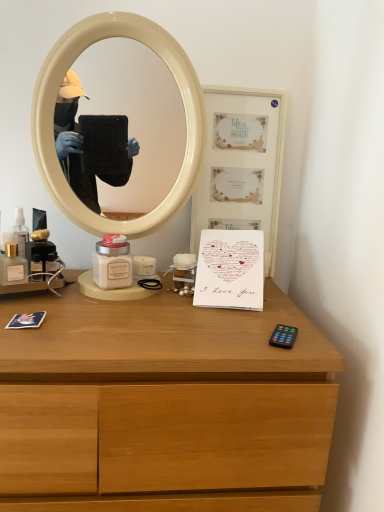
Identify the location of wooden at lower right. (164, 402).

What do you see at coordinates (164, 402) in the screenshot? I see `wooden at lower right` at bounding box center [164, 402].

Locate an element on the screen. The height and width of the screenshot is (512, 384). wooden at lower right is located at coordinates (164, 402).